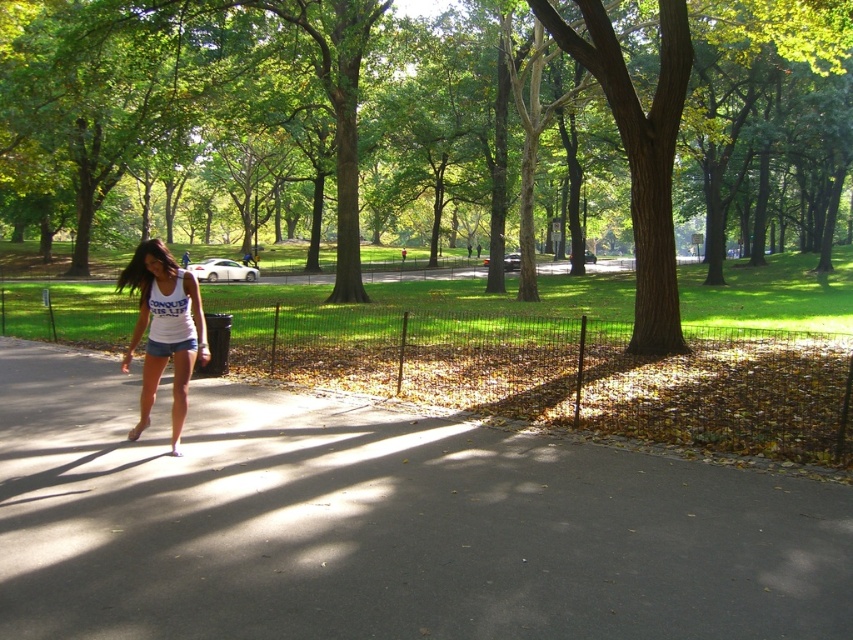
The height and width of the screenshot is (640, 853). What do you see at coordinates (381, 524) in the screenshot?
I see `gray asphalt pavement at center` at bounding box center [381, 524].

Which is below, gray asphalt pavement at center or white cotton tank top at center?

Positioned lower is gray asphalt pavement at center.

Based on the photo, who is more distant from viewer, [403,529] or [131,259]?

The point [131,259] is behind.

Find the location of `gray asphalt pavement at center`. gray asphalt pavement at center is located at coordinates (381, 524).

Between brown textured tree at center and gray asphalt pavement at center, which one is positioned lower?

Positioned lower is gray asphalt pavement at center.

Can you confirm if brown textured tree at center is positioned below gray asphalt pavement at center?

Incorrect, brown textured tree at center is not positioned below gray asphalt pavement at center.

Find the location of a particular element. The width and height of the screenshot is (853, 640). brown textured tree at center is located at coordinates (428, 131).

The image size is (853, 640). Identify the location of brown textured tree at center. (428, 131).

Which is above, brown textured tree at center or white cotton tank top at center?

Positioned higher is brown textured tree at center.

Between brown textured tree at center and white cotton tank top at center, which one has less height?

With less height is white cotton tank top at center.

Does point (225, 136) come in front of point (160, 291)?

No, (225, 136) is behind (160, 291).

Locate an element on the screen. brown textured tree at center is located at coordinates (428, 131).